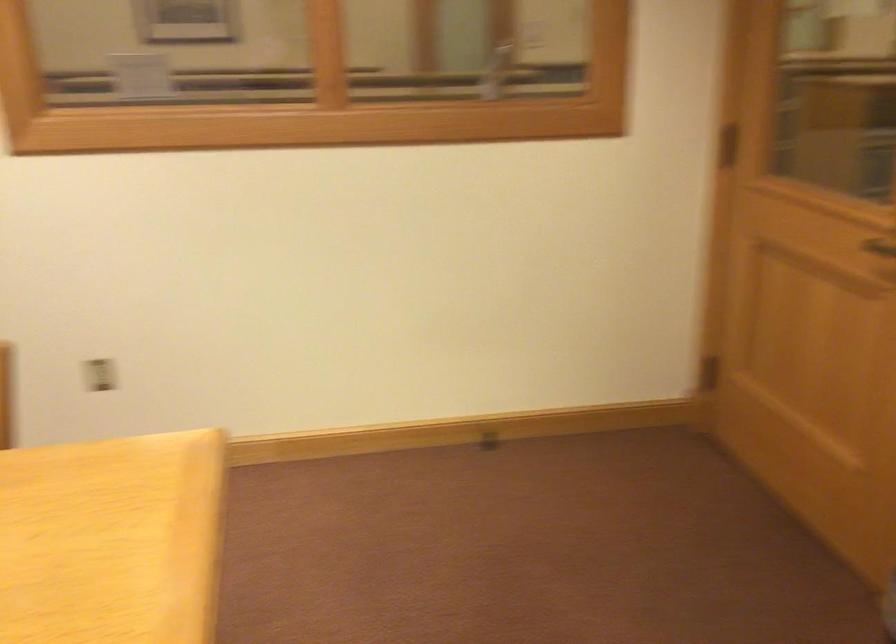
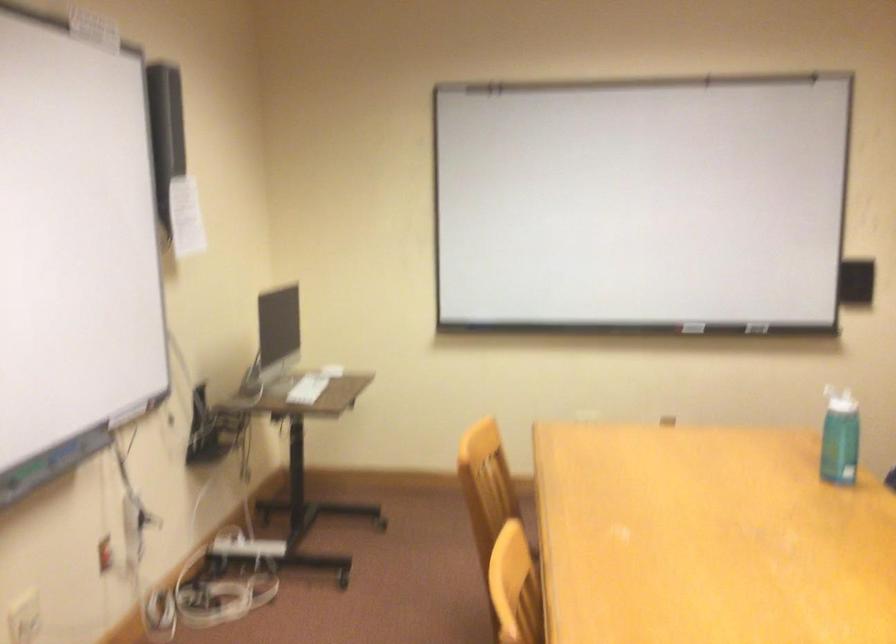
Consider the image. How did the camera likely rotate?

The camera rotated toward left-down.